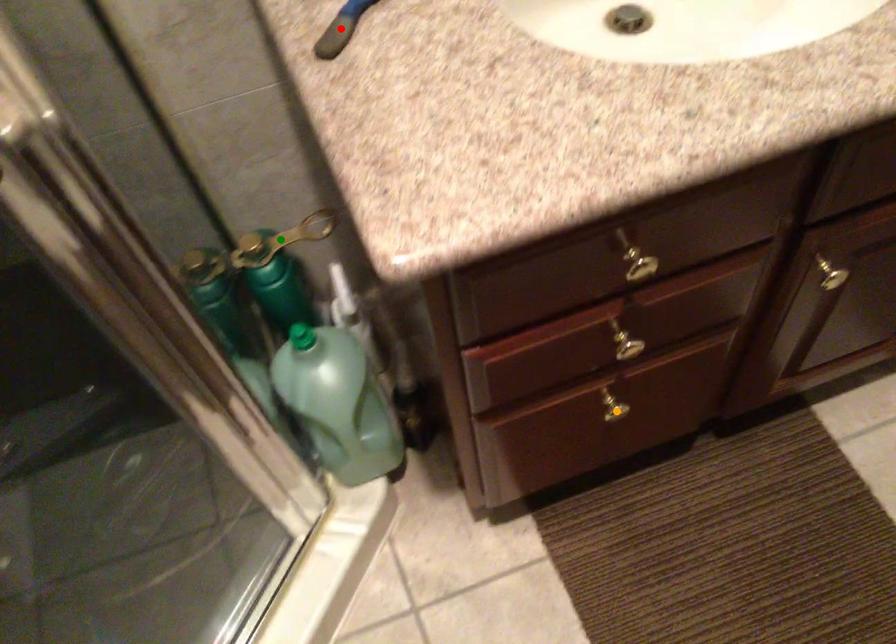
Order these from nearest to farthest:
red point | orange point | green point

red point
orange point
green point